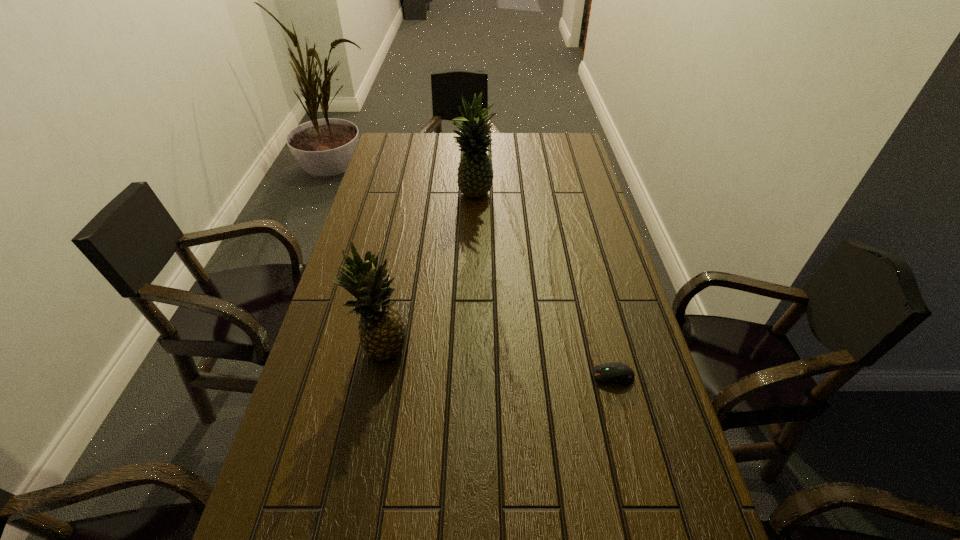
At what (x,y) coordinates should I click in order to perform the action: click on vacant area between the rightmost object and the farthest object. Please return your answer as a coordinate pair (x, y). Image resolution: width=960 pixels, height=540 pixels. Looking at the image, I should click on (543, 286).

At what (x,y) coordinates should I click in order to perform the action: click on free spot between the leftmost object and the computer equipment. Please return your answer as a coordinate pair (x, y). This screenshot has width=960, height=540. Looking at the image, I should click on (498, 363).

Where is `free space between the nearer pineapple and the farthest object`? free space between the nearer pineapple and the farthest object is located at coordinates (429, 273).

I want to click on free point between the leftmost object and the shortest object, so click(498, 363).

Where is `vacant point located between the rightmost object and the right pineapple`? The image size is (960, 540). vacant point located between the rightmost object and the right pineapple is located at coordinates (543, 286).

Image resolution: width=960 pixels, height=540 pixels. Identify the location of empty location between the farthest object and the computer equipment. (543, 286).

This screenshot has height=540, width=960. Identify the location of the second closest object to the leftmost object. (475, 176).

Identify which object is the second closest to the rightmost object. Please provide its 2D coordinates. Your answer should be formatted as a tuple, i.e. [(x, y)], where the tuple contains the x and y coordinates of a point satisfying the conditions above.

[(475, 176)]